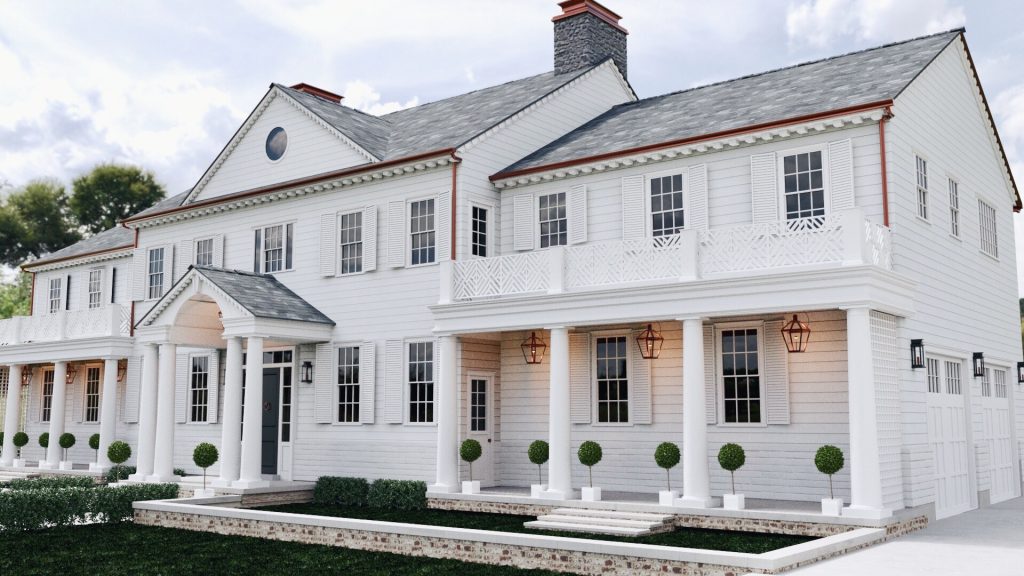
Find the location of a particular element. Image resolution: width=1024 pixels, height=576 pixels. front door is located at coordinates (268, 385).